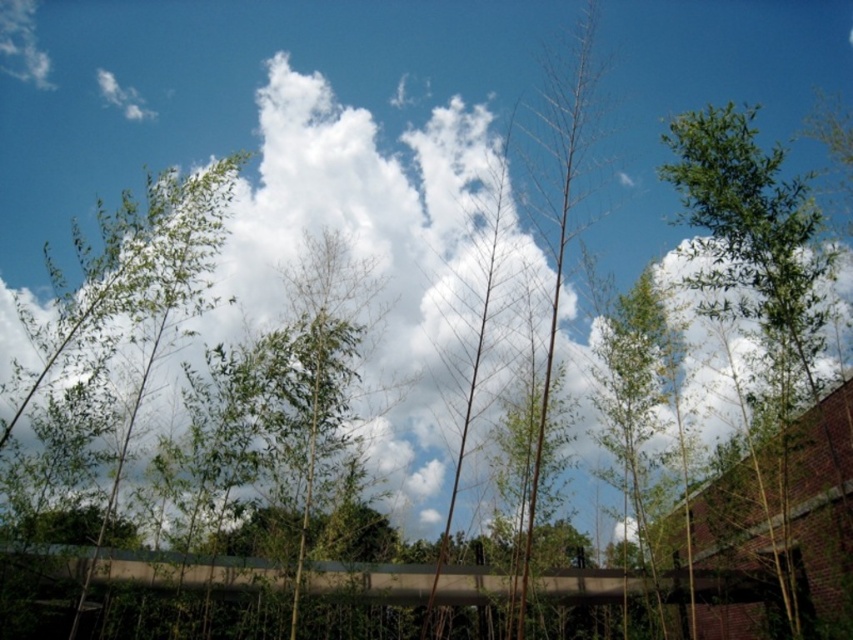
Which is behind, point (421, 525) or point (74, 611)?

Positioned behind is point (421, 525).

Between point (279, 173) and point (13, 422), which one is positioned in front?

Point (13, 422) is in front.

Is point (316, 208) behind point (173, 300)?

Yes, point (316, 208) is behind point (173, 300).

At what (x,y) coordinates should I click in order to perform the action: click on white fluffy cloud at upper center. Please return your answer as a coordinate pair (x, y). Image resolution: width=853 pixels, height=640 pixels. Looking at the image, I should click on (368, 248).

Can you confirm if white fluffy cloud at upper center is smaller than green leafy tree at upper right?

No, white fluffy cloud at upper center is not smaller than green leafy tree at upper right.

Can you confirm if white fluffy cloud at upper center is wider than green leafy tree at upper right?

Yes.

Locate an element on the screen. Image resolution: width=853 pixels, height=640 pixels. white fluffy cloud at upper center is located at coordinates (368, 248).

Who is positioned more to the left, green leafy tree at left or green leafy tree at upper right?

From the viewer's perspective, green leafy tree at left appears more on the left side.

Is green leafy tree at left bigger than green leafy tree at upper right?

Correct, green leafy tree at left is larger in size than green leafy tree at upper right.

Does point (135, 240) come behind point (717, 218)?

Yes.

You are a GUI agent. You are given a task and a screenshot of the screen. Output one action in this format:
    pyautogui.click(x=<x>, y=<y>)
    Task: Click on the green leafy tree at left
    This screenshot has height=640, width=853.
    Given the screenshot: What is the action you would take?
    pyautogui.click(x=138, y=289)